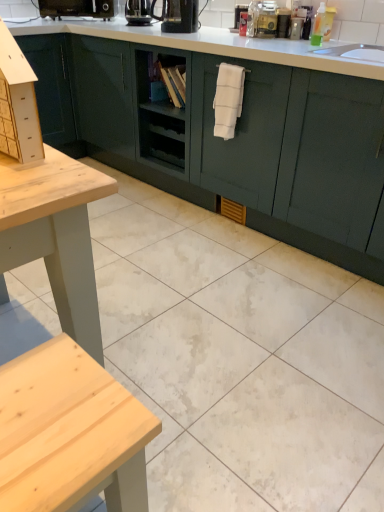
Question: Considering the relative sizes of white glossy tile at center and translucent plastic bottle at upper center in the image provided, is white glossy tile at center shorter than translucent plastic bottle at upper center?

Choices:
 (A) no
 (B) yes

Answer: (B)

Question: Does white glossy tile at center touch translucent plastic bottle at upper center?

Choices:
 (A) no
 (B) yes

Answer: (A)

Question: From the image's perspective, is white glossy tile at center on top of translucent plastic bottle at upper center?

Choices:
 (A) yes
 (B) no

Answer: (B)

Question: Is white glossy tile at center facing away from translucent plastic bottle at upper center?

Choices:
 (A) yes
 (B) no

Answer: (B)

Question: Is translucent plastic bottle at upper center a part of white glossy tile at center?

Choices:
 (A) yes
 (B) no

Answer: (B)

Question: From the image's perspective, is white glossy tile at center located above or below translucent plastic bottle at upper right?

Choices:
 (A) above
 (B) below

Answer: (B)

Question: Looking at their shapes, would you say white glossy tile at center is wider or thinner than translucent plastic bottle at upper right?

Choices:
 (A) thin
 (B) wide

Answer: (B)

Question: Would you say white glossy tile at center is to the left or to the right of translucent plastic bottle at upper right in the picture?

Choices:
 (A) left
 (B) right

Answer: (A)

Question: Does point (286, 506) appear closer or farther from the camera than point (319, 30)?

Choices:
 (A) farther
 (B) closer

Answer: (B)

Question: Is translucent plastic bottle at upper right situated inside black glossy coffee machine at upper center, placed as the second coffee machine when sorted from left to right, or outside?

Choices:
 (A) outside
 (B) inside

Answer: (A)

Question: Considering the positions of point (322, 22) and point (142, 10), is point (322, 22) closer or farther from the camera than point (142, 10)?

Choices:
 (A) farther
 (B) closer

Answer: (B)

Question: From a real-world perspective, relative to black glossy coffee machine at upper center, acting as the second coffee machine starting from the front, is translucent plastic bottle at upper right vertically above or below?

Choices:
 (A) above
 (B) below

Answer: (A)

Question: From the image's perspective, is translucent plastic bottle at upper right above or below black glossy coffee machine at upper center, which is the 2th coffee machine in back-to-front order?

Choices:
 (A) below
 (B) above

Answer: (A)

Question: Is translucent plastic bottle at upper center situated inside translucent plastic bottle at upper right or outside?

Choices:
 (A) inside
 (B) outside

Answer: (B)

Question: In terms of height, does translucent plastic bottle at upper center look taller or shorter compared to translucent plastic bottle at upper right?

Choices:
 (A) short
 (B) tall

Answer: (B)